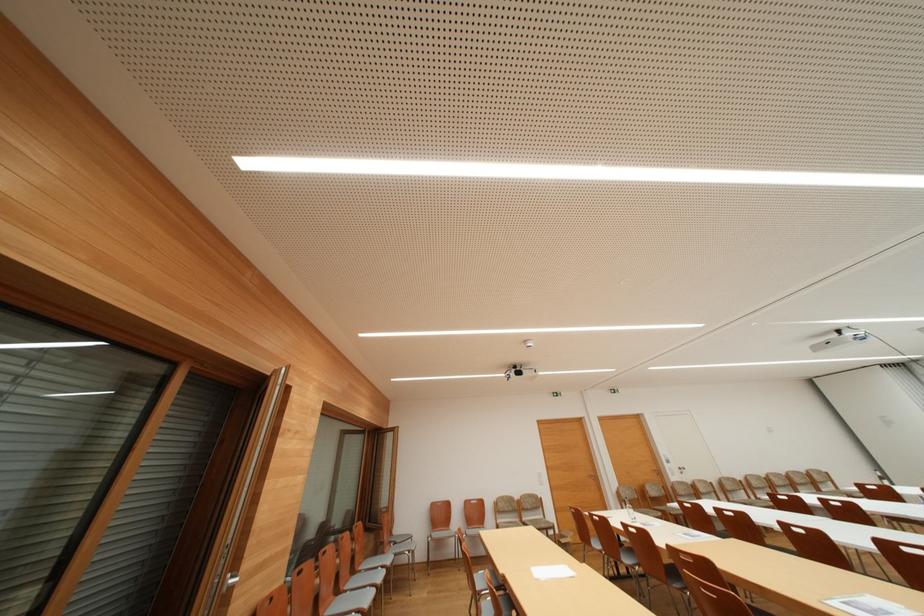
This screenshot has width=924, height=616. Find the location of `glass water bottle`. glass water bottle is located at coordinates (629, 512).